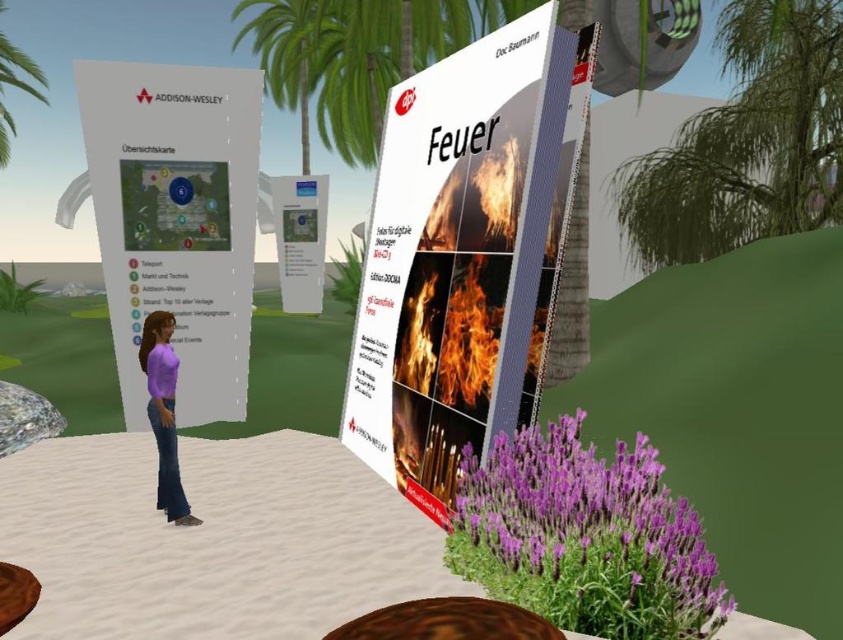
You are navigating a virtual educational environment and see a white glossy book at center with a point marked at coordinates (459, 257). What does this point indicate?

The point at coordinates (459, 257) on the white glossy book at center indicates a specific location or station as per the map displayed on the Addison Wesley panel.

You are a virtual tour guide in this environment. You need to inform visitors about the location of the rustic wood stool at lower center and the matte purple shirt at center. Based on the scene, can you determine which object is placed on top of the other?

The rustic wood stool at lower center is positioned over matte purple shirt at center, meaning the stool is placed on top of the shirt.